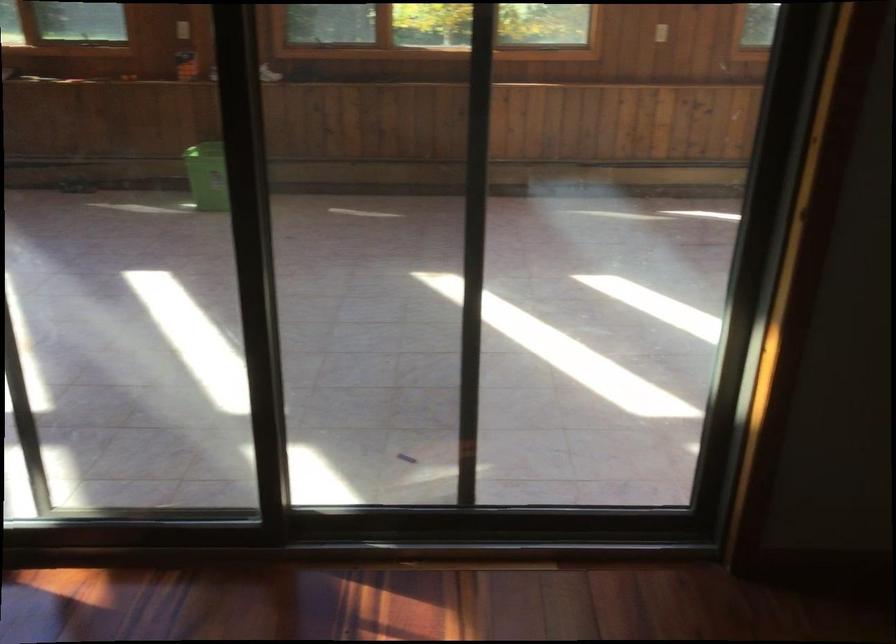
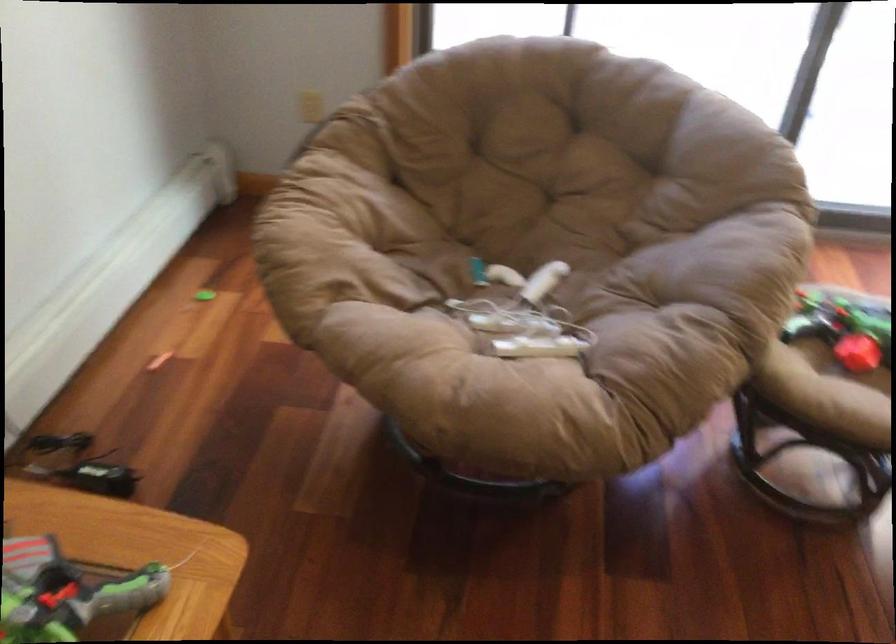
Question: What movement of the cameraman would produce the second image?

Choices:
 (A) Left
 (B) Right
 (C) Forward
 (D) Backward

Answer: (A)